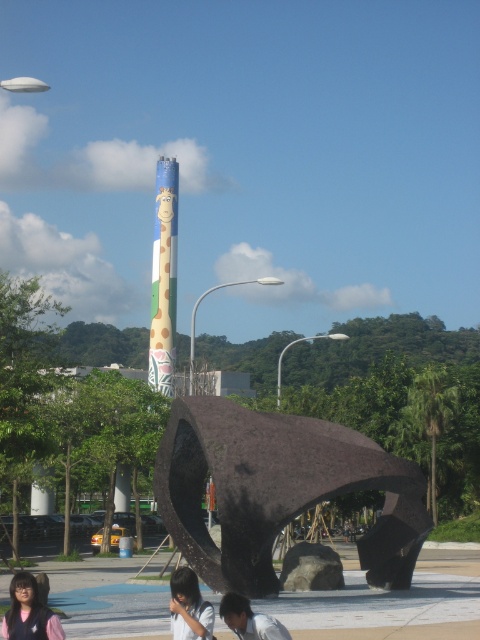
Consider the image. You are standing at the dark brown hair at lower center and want to take a photo of the multicolored painted totem pole at center. If your camera has a maximum zoom range of 50 meters, will you be able to capture the totem pole clearly without moving closer?

The multicolored painted totem pole at center is 52.07 meters away from the dark brown hair at lower center. Since the camera can only zoom up to 50 meters, you will not be able to capture the totem pole clearly without moving closer.

You are standing at the origin point in the image and want to locate the dark brown stone sculpture at center. What are the coordinates of its position?

The dark brown stone sculpture at center is located at coordinates point [277,490].

You are standing in the outdoor urban setting and want to take a photo of the dark brown stone sculpture at center. If your camera has a maximum zoom range of 20 meters, will you be able to capture the sculpture clearly without moving closer?

The dark brown stone sculpture at center is 25.62 meters away from the viewer. Since the camera can only zoom up to 20 meters, you won not be able to capture it clearly without moving closer.